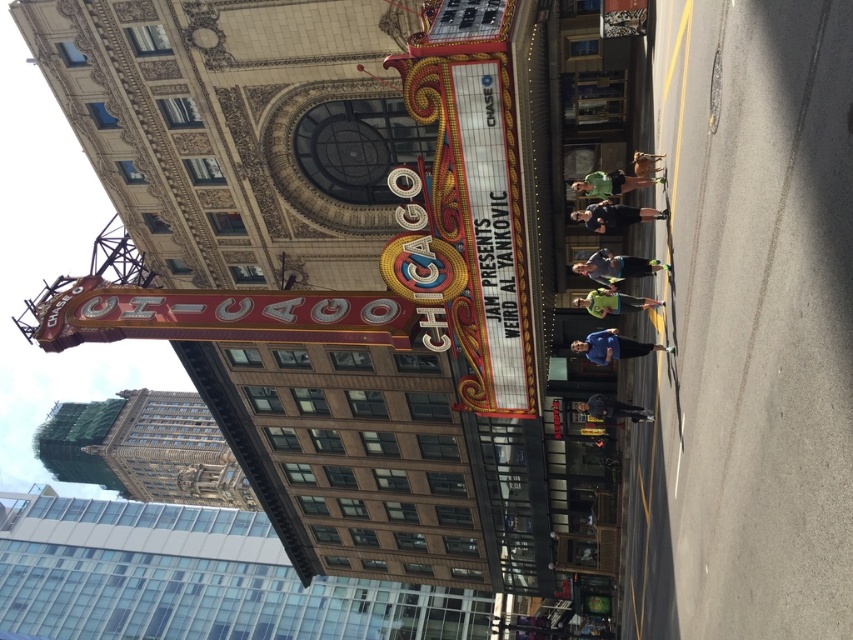
Based on the photo, can you confirm if matte black jacket at center is wider than green matte shirt at center?

Correct, the width of matte black jacket at center exceeds that of green matte shirt at center.

Is matte black jacket at center to the right of green matte shirt at center from the viewer's perspective?

Correct, you'll find matte black jacket at center to the right of green matte shirt at center.

Find the location of a particular element. The width and height of the screenshot is (853, 640). matte black jacket at center is located at coordinates click(x=618, y=266).

Does dark gray pants at center have a smaller size compared to metallic gold statue at center?

No.

Measure the distance between dark gray pants at center and camera.

The distance of dark gray pants at center from camera is 99.61 feet.

The image size is (853, 640). Describe the element at coordinates (612, 408) in the screenshot. I see `dark gray pants at center` at that location.

This screenshot has width=853, height=640. In order to click on dark gray pants at center in this screenshot , I will do `click(612, 408)`.

Between green fabric shirt at center and metallic gold statue at center, which one appears on the left side from the viewer's perspective?

From the viewer's perspective, green fabric shirt at center appears more on the left side.

Is the position of green fabric shirt at center more distant than that of metallic gold statue at center?

No, green fabric shirt at center is closer to the viewer.

You are a GUI agent. You are given a task and a screenshot of the screen. Output one action in this format:
    pyautogui.click(x=<x>, y=<y>)
    Task: Click on the green fabric shirt at center
    This screenshot has height=640, width=853.
    Given the screenshot: What is the action you would take?
    point(611,182)

This screenshot has height=640, width=853. Identify the location of green fabric shirt at center. (611, 182).